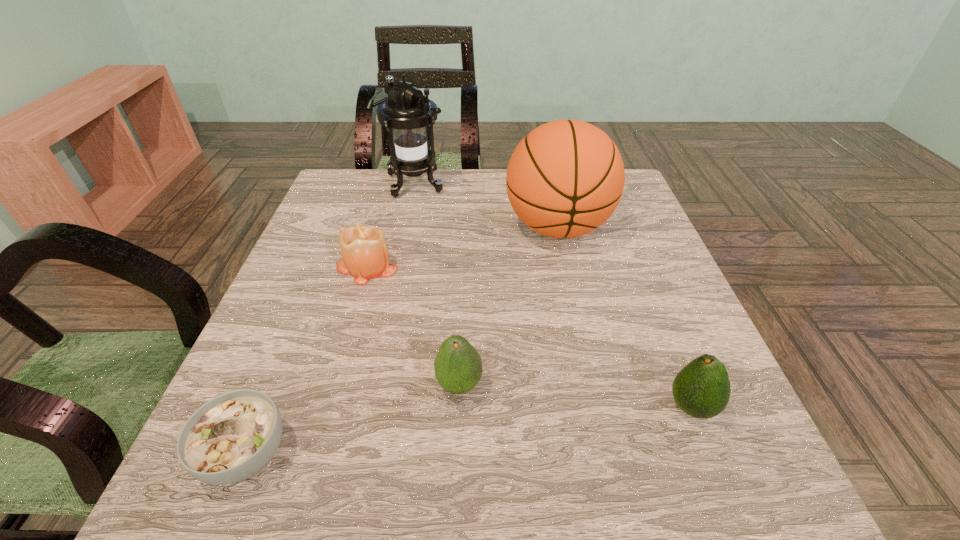
Find the location of a particular element. lantern is located at coordinates (408, 112).

Where is `basketball`? The height and width of the screenshot is (540, 960). basketball is located at coordinates click(x=565, y=178).

At what (x,y) coordinates should I click in order to perform the action: click on candle. Please return your answer as a coordinate pair (x, y). Image resolution: width=960 pixels, height=540 pixels. Looking at the image, I should click on (364, 250).

This screenshot has height=540, width=960. I want to click on the left avocado, so click(458, 367).

The height and width of the screenshot is (540, 960). I want to click on the right avocado, so click(701, 389).

Identify the location of soup bowl. (231, 437).

The image size is (960, 540). I want to click on vacant space located 0.280m on the front of the lantern, so (394, 270).

I want to click on vacant space located on the front of the basketball, so click(602, 428).

Where is `vacant region located on the front of the candle`? This screenshot has height=540, width=960. vacant region located on the front of the candle is located at coordinates (331, 387).

At what (x,y) coordinates should I click in order to perform the action: click on vacant point located on the back of the third object from right to left. Please return your answer as a coordinate pair (x, y). This screenshot has width=960, height=540. Looking at the image, I should click on (466, 233).